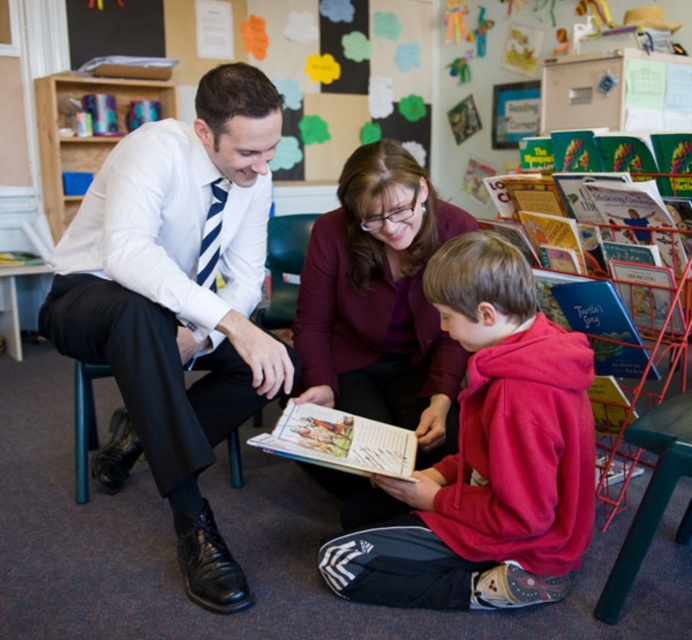
Which is more to the left, white shirt at left or hardcover book at center?

Positioned to the left is white shirt at left.

Which is below, white shirt at left or hardcover book at center?

Positioned lower is hardcover book at center.

Where is `white shirt at left`? This screenshot has height=640, width=692. white shirt at left is located at coordinates (179, 301).

Can you confirm if black fabric chair at left is positioned to the right of hardcover book at center?

No, black fabric chair at left is not to the right of hardcover book at center.

Which is in front, point (235, 428) or point (336, 422)?

Point (336, 422) is in front.

At what (x,y) coordinates should I click in order to perform the action: click on black fabric chair at left. Please return your answer as a coordinate pair (x, y). The height and width of the screenshot is (640, 692). Looking at the image, I should click on (98, 440).

Which is in front, point (334, 570) or point (236, 456)?

Point (334, 570)

Who is higher up, red fleece hoodie at center or black fabric chair at left?

Positioned higher is red fleece hoodie at center.

What do you see at coordinates (484, 458) in the screenshot? Image resolution: width=692 pixels, height=640 pixels. I see `red fleece hoodie at center` at bounding box center [484, 458].

At what (x,y) coordinates should I click in order to perform the action: click on red fleece hoodie at center. Please return your answer as a coordinate pair (x, y). This screenshot has width=692, height=640. Looking at the image, I should click on (484, 458).